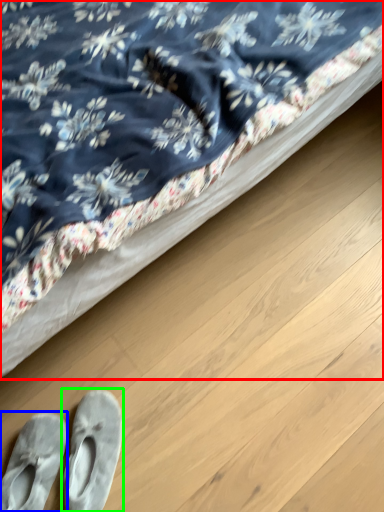
Question: Which object is the closest to the bed (highlighted by a red box)? Choose among these: footwear (highlighted by a blue box) or footwear (highlighted by a green box).

Choices:
 (A) footwear
 (B) footwear

Answer: (B)